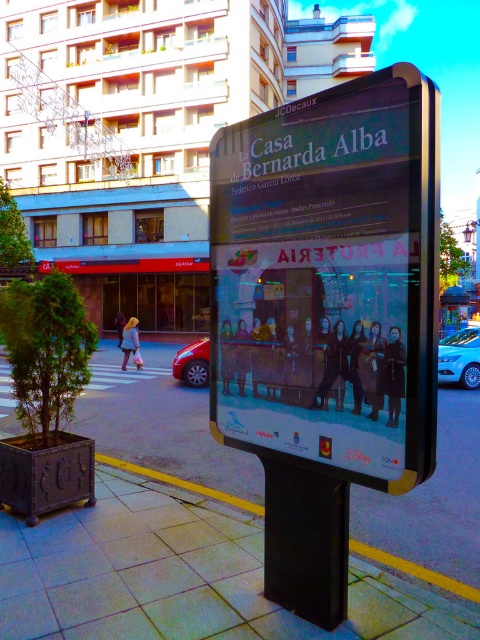
Question: Is the position of metallic poster at center less distant than that of shiny red car at center?

Choices:
 (A) no
 (B) yes

Answer: (B)

Question: Which point is closer to the camera?

Choices:
 (A) (469, 349)
 (B) (191, 358)

Answer: (B)

Question: Among these objects, which one is nearest to the camera?

Choices:
 (A) smooth concrete pavement at center
 (B) shiny red car at center
 (C) blue metallic car at lower right
 (D) metallic poster at center

Answer: (D)

Question: Does blue metallic car at lower right appear under shiny red car at center?

Choices:
 (A) yes
 (B) no

Answer: (B)

Question: Is smooth concrete pavement at center thinner than shiny red car at center?

Choices:
 (A) yes
 (B) no

Answer: (B)

Question: Which point is closer to the camera taking this photo?

Choices:
 (A) (456, 378)
 (B) (201, 384)

Answer: (B)